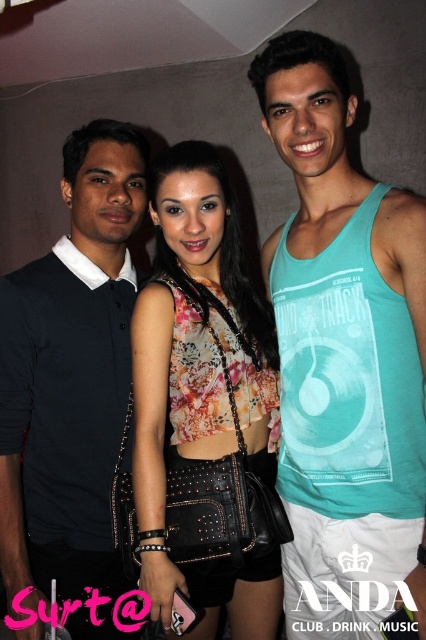
From the picture: Based on the coordinates provided, which object is located at point (71, 372)?

The point (71, 372) corresponds to the black matte shirt at left.

You are organizing a clothing donation drive and need to categorize the teal tank top at center and the black matte shirt at left based on their sizes. Which one should be placed in the large size bin?

The teal tank top at center should be placed in the large size bin because it has a larger size compared to the black matte shirt at left.

You are standing in front of the group of people in the image. You notice two points marked in the scene. The first point is at coordinate (x=345, y=470) and the second is at (x=264, y=609). Which point is closer to you?

The point at coordinate (x=345, y=470) is closer to you because it is nearer to the camera compared to the point at (x=264, y=609).